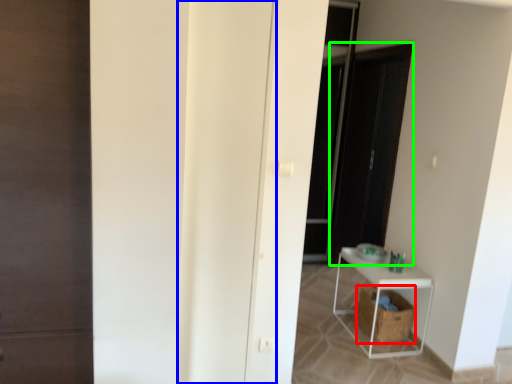
Question: Estimate the real-world distances between objects in this image. Which object is farther from laundry basket (highlighted by a red box), door (highlighted by a blue box) or screen door (highlighted by a green box)?

Choices:
 (A) door
 (B) screen door

Answer: (A)